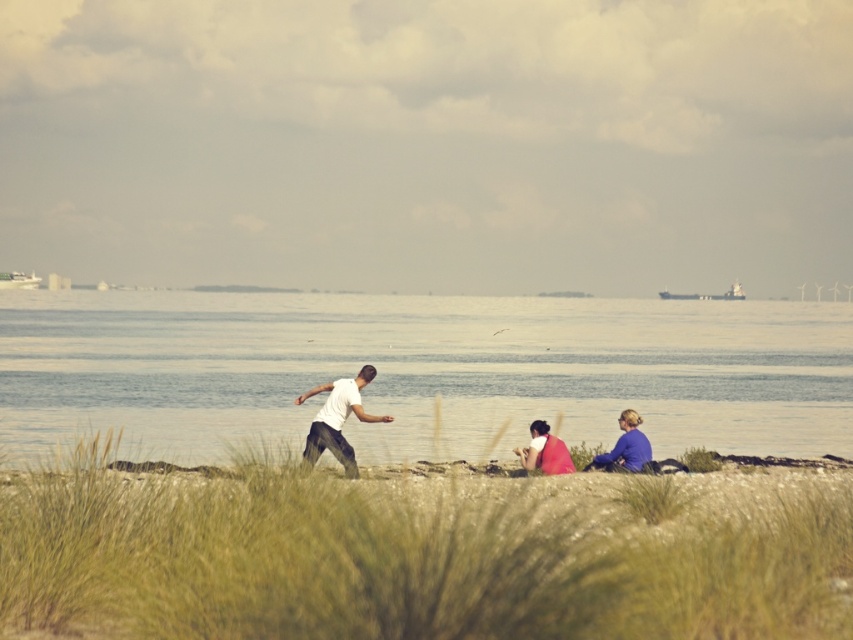
Question: Is clear blue water at center thinner than white matte shirt at center?

Choices:
 (A) no
 (B) yes

Answer: (A)

Question: Considering the real-world distances, which object is closest to the grassy sand at center?

Choices:
 (A) matte red shirt at center
 (B) blue fabric at lower right

Answer: (A)

Question: Which point is farther to the camera?

Choices:
 (A) grassy sand at center
 (B) white matte shirt at center
 (C) matte red shirt at center

Answer: (B)

Question: Is grassy sand at center smaller than blue fabric at lower right?

Choices:
 (A) yes
 (B) no

Answer: (B)

Question: Does blue fabric at lower right have a smaller size compared to matte red shirt at center?

Choices:
 (A) no
 (B) yes

Answer: (A)

Question: Which object is positioned closest to the clear blue water at center?

Choices:
 (A) blue fabric at lower right
 (B) white matte shirt at center
 (C) matte red shirt at center
 (D) grassy sand at center

Answer: (C)